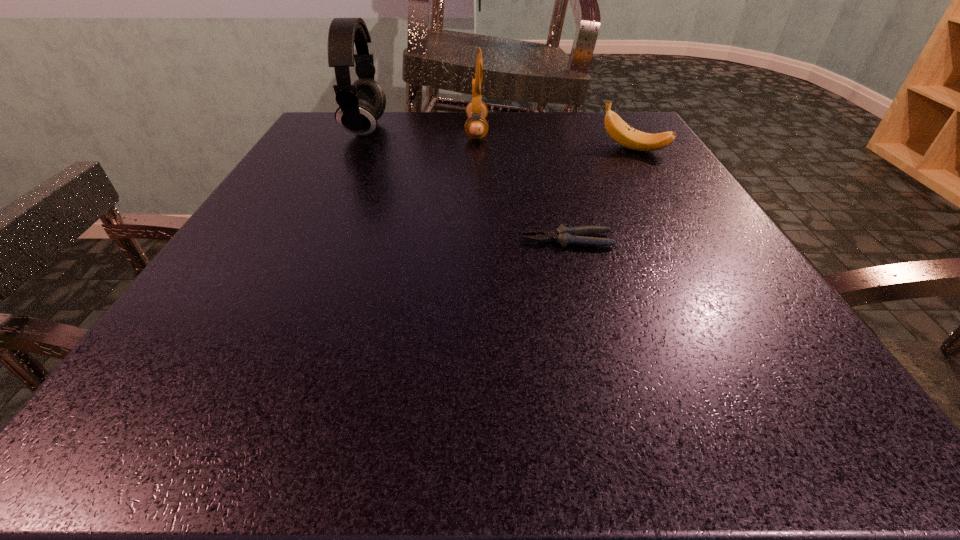
I want to click on vacant region at the near edge of the desktop, so click(520, 430).

Where is `free location at the left edge of the desktop`? This screenshot has width=960, height=540. free location at the left edge of the desktop is located at coordinates (263, 197).

Where is `vacant space at the right edge`? This screenshot has width=960, height=540. vacant space at the right edge is located at coordinates (746, 314).

The width and height of the screenshot is (960, 540). In the image, there is a desktop. In order to click on free space at the far left corner in this screenshot , I will do `click(343, 148)`.

Where is `free space at the far right corner`? This screenshot has width=960, height=540. free space at the far right corner is located at coordinates (596, 129).

This screenshot has height=540, width=960. In the image, there is a desktop. Find the location of `free space at the near right corner`. free space at the near right corner is located at coordinates (823, 403).

Where is `free area in between the rightmost object and the right earphone`? free area in between the rightmost object and the right earphone is located at coordinates (555, 140).

At what (x,y) coordinates should I click in order to perform the action: click on free space between the shorter earphone and the shortest object. Please return your answer as a coordinate pair (x, y). This screenshot has height=540, width=960. Looking at the image, I should click on (522, 185).

The height and width of the screenshot is (540, 960). Find the location of `vacant space in between the leftmost object and the third tallest object`. vacant space in between the leftmost object and the third tallest object is located at coordinates (499, 139).

Locate an element on the screen. vacant space in between the second object from left to right and the second shortest object is located at coordinates (555, 140).